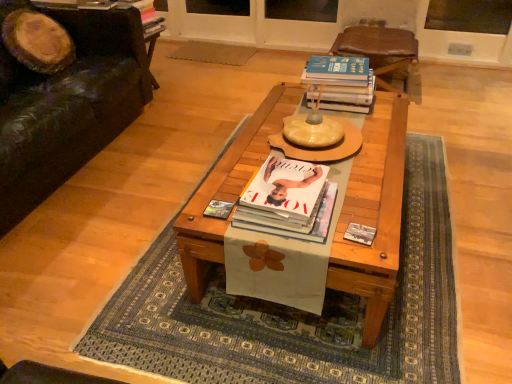
This screenshot has width=512, height=384. I want to click on vacant location behind matte paper magazine at center, so click(222, 187).